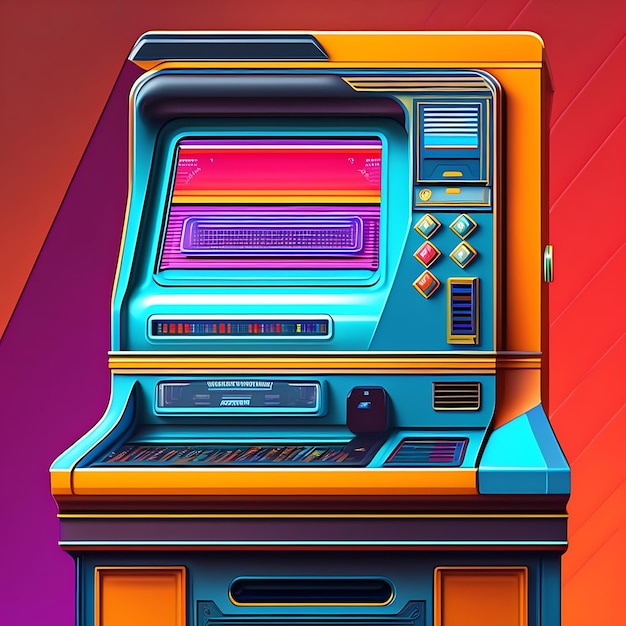
At what (x,y) coordinates should I click in order to perform the action: click on keyboard. Please return your answer as a coordinate pair (x, y). Looking at the image, I should click on (123, 453), (150, 453), (198, 457), (223, 457), (260, 459), (277, 457), (298, 456), (321, 454).